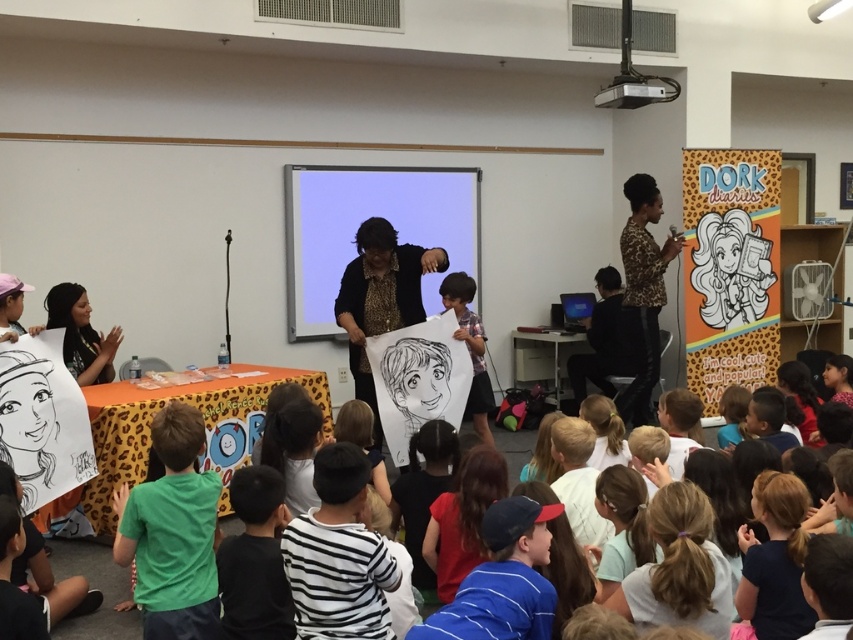
You are standing in the room and want to place a small decoration between the two points, point (165,525) and point (454,284). Which point should the decoration be closer to in order to appear larger to someone viewing from the front of the room?

The decoration should be placed closer to point (165,525) because it is closer to the camera, making objects placed there appear larger to viewers at the front of the room.

You are organizing a photo shoot in this room and need to position a large backdrop. The leopard print jacket at upper right and the matte white paper at center are in the way. Which object should you move first to clear more space?

You should move the leopard print jacket at upper right first because its width is larger than the matte white paper at center, so removing it will free up more space.